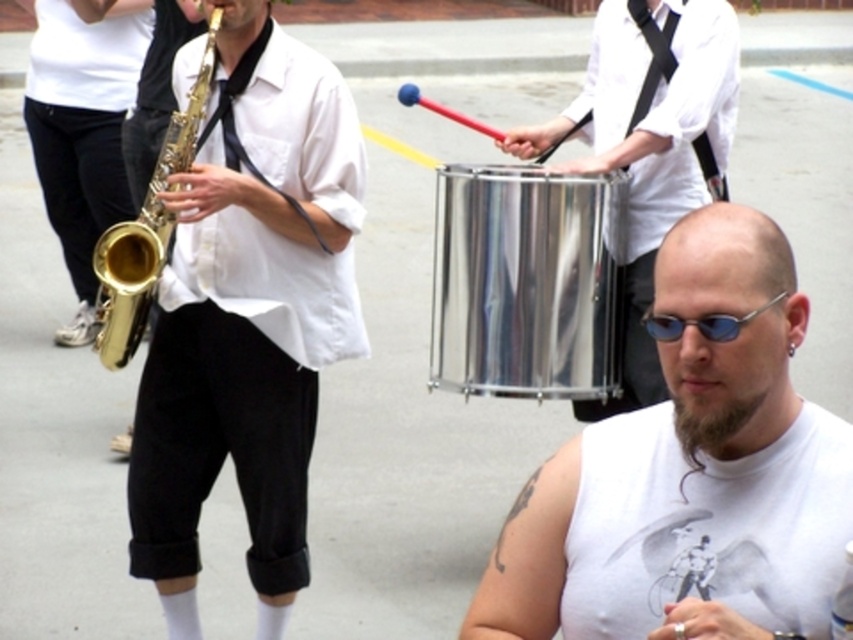
Question: Which object is the farthest from the gold shiny trumpet at left?

Choices:
 (A) white sleeveless shirt at center
 (B) brushed metal drum at center
 (C) shiny metallic drum at center
 (D) blue reflective glasses at center

Answer: (B)

Question: Based on their relative distances, which object is nearer to the shiny metallic drum at center?

Choices:
 (A) white sleeveless shirt at center
 (B) brushed metal drum at center

Answer: (A)

Question: Among these points, which one is nearest to the camera?

Choices:
 (A) (479, 358)
 (B) (672, 326)

Answer: (B)

Question: Is gold shiny saxophone at left further to the viewer compared to brushed metal drum at center?

Choices:
 (A) yes
 (B) no

Answer: (A)

Question: Can you confirm if gold shiny saxophone at left is wider than brushed metal drum at center?

Choices:
 (A) no
 (B) yes

Answer: (B)

Question: Does shiny metallic drum at center come behind blue reflective glasses at center?

Choices:
 (A) yes
 (B) no

Answer: (A)